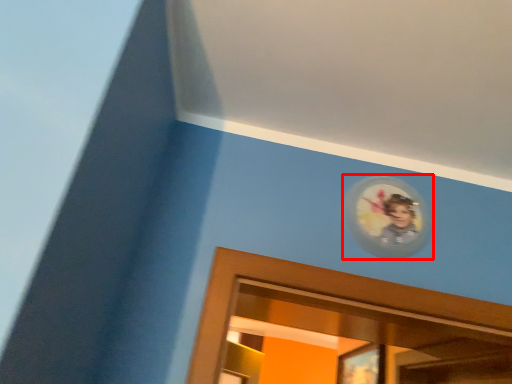
Question: From the image's perspective, where is picture frame (annotated by the red box) located relative to portrait?

Choices:
 (A) below
 (B) above

Answer: (B)